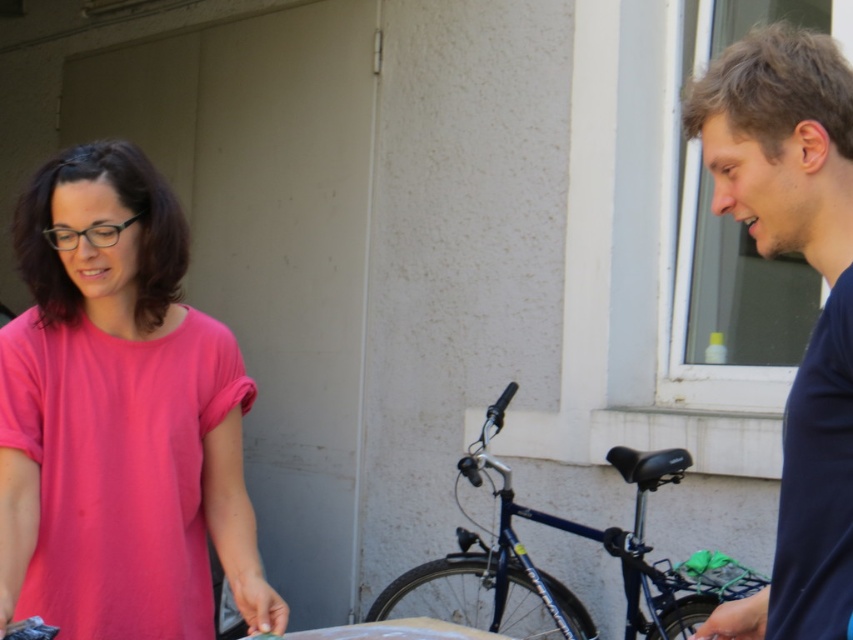
Consider the image. Between dark blue shirt at right and shiny blue bicycle at center, which one is positioned lower?

Positioned lower is shiny blue bicycle at center.

Is point (828, 387) more distant than point (630, 596)?

No, it is not.

You are a GUI agent. You are given a task and a screenshot of the screen. Output one action in this format:
    pyautogui.click(x=<x>, y=<y>)
    Task: Click on the dark blue shirt at right
    The width and height of the screenshot is (853, 640).
    Given the screenshot: What is the action you would take?
    [820, 314]

Between pink matte shirt at left and shiny blue bicycle at center, which one has more height?

shiny blue bicycle at center is taller.

Who is more distant from viewer, (135, 176) or (693, 616)?

Point (693, 616)

Between point (93, 237) and point (548, 577), which one is positioned behind?

Point (548, 577)

At what (x,y) coordinates should I click in order to perform the action: click on pink matte shirt at left. Please return your answer as a coordinate pair (x, y). Looking at the image, I should click on (119, 417).

What are the coordinates of `pink matte shirt at left` in the screenshot? It's located at (119, 417).

Is pink matte shirt at left below dark blue shirt at right?

Correct, pink matte shirt at left is located below dark blue shirt at right.

Is point (236, 380) farther from camera compared to point (843, 552)?

Yes, point (236, 380) is farther from viewer.

Where is `pink matte shirt at left`? The image size is (853, 640). pink matte shirt at left is located at coordinates (119, 417).